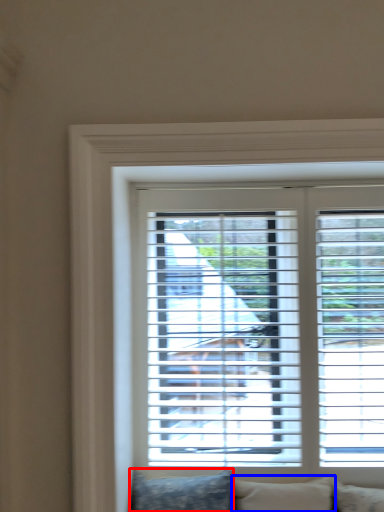
Question: Which point is further to the camera, pillow (highlighted by a red box) or pillow (highlighted by a blue box)?

Choices:
 (A) pillow
 (B) pillow

Answer: (B)